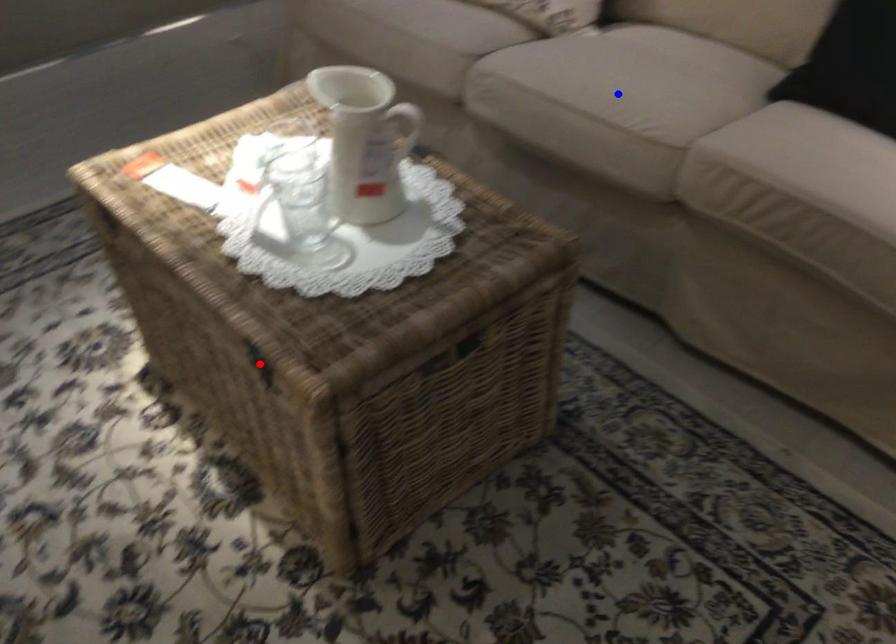
Question: In the image, two points are highlighted. Which point is nearer to the camera? Reply with the corresponding letter.

Choices:
 (A) blue point
 (B) red point

Answer: (B)